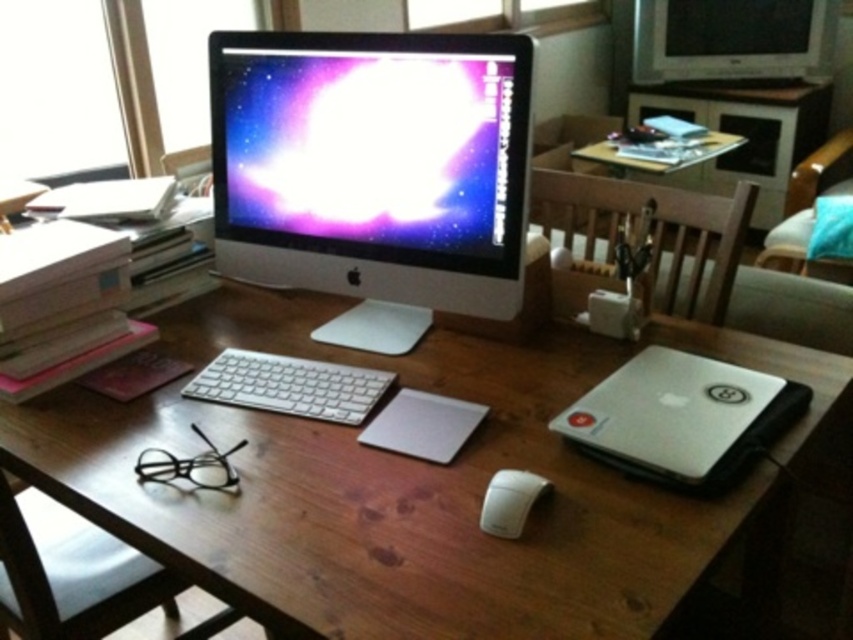
You are sitting in the wooden chair at center and looking at the white glossy computer monitor at center. Is the monitor positioned above or below your eye level?

The white glossy computer monitor at center is located below the wooden chair at center, so it is positioned below your eye level.